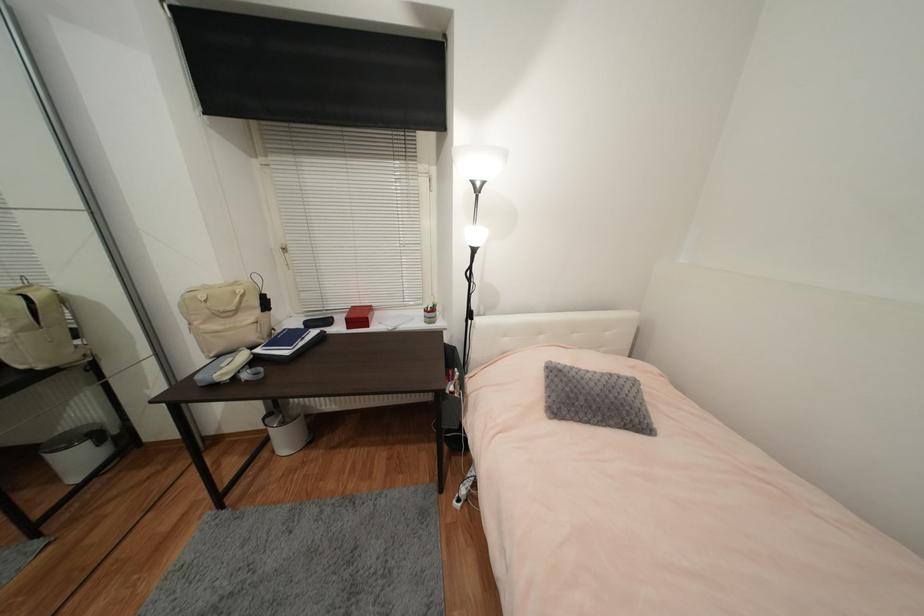
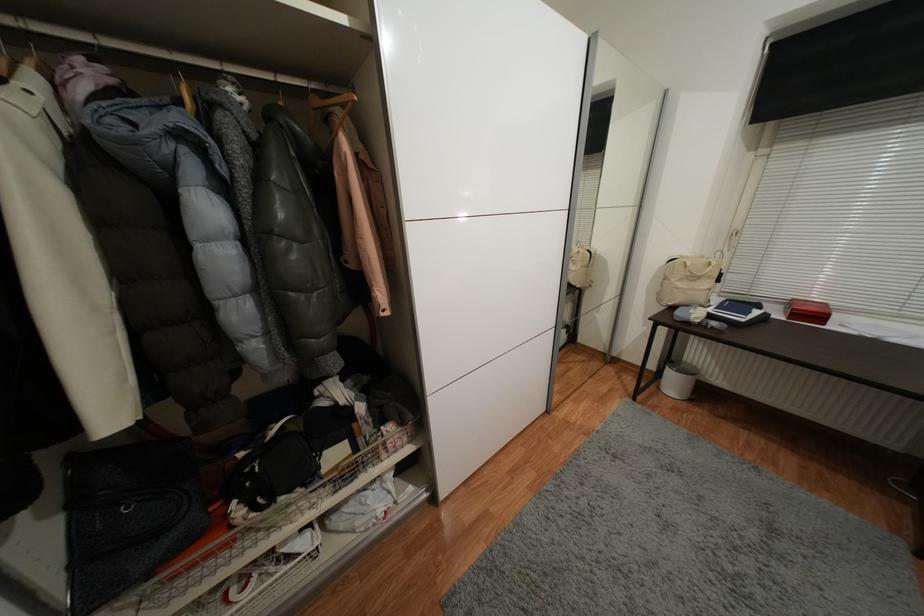
The point at (58, 371) is marked in the first image. Where is the corresponding point in the second image?

(582, 291)